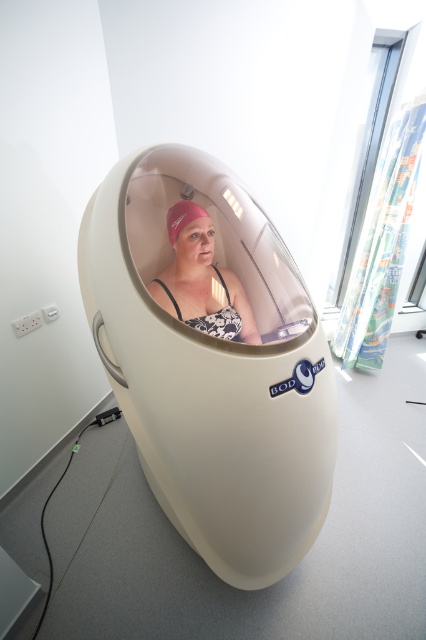
Question: Is white matte capsule at center wider than pink fabric swim cap at center?

Choices:
 (A) yes
 (B) no

Answer: (A)

Question: Which point appears farthest from the camera in this image?

Choices:
 (A) (184, 225)
 (B) (224, 381)

Answer: (A)

Question: Does white matte capsule at center appear on the right side of pink fabric swim cap at center?

Choices:
 (A) yes
 (B) no

Answer: (B)

Question: Among these points, which one is farthest from the camera?

Choices:
 (A) (284, 472)
 (B) (241, 292)

Answer: (B)

Question: Is white matte capsule at center to the right of pink fabric swim cap at center from the viewer's perspective?

Choices:
 (A) no
 (B) yes

Answer: (A)

Question: Which point is closer to the camera?

Choices:
 (A) (285, 449)
 (B) (245, 332)

Answer: (A)